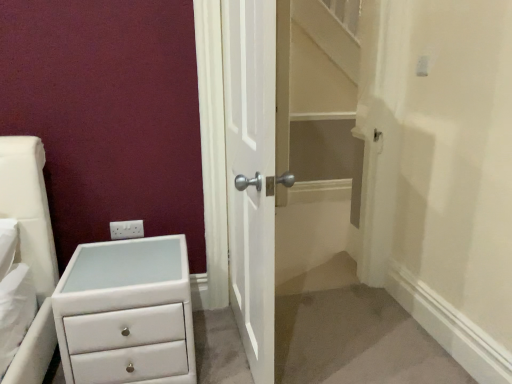
Question: Is white wooden door at center bigger or smaller than white glossy chest of drawers at lower left?

Choices:
 (A) big
 (B) small

Answer: (A)

Question: In the image, is white wooden door at center positioned in front of or behind white glossy chest of drawers at lower left?

Choices:
 (A) behind
 (B) front

Answer: (B)

Question: Which object is the closest to the white plastic electric outlet at upper left?

Choices:
 (A) white glossy chest of drawers at lower left
 (B) white wooden door at center

Answer: (A)

Question: Considering the real-world distances, which object is farthest from the white wooden door at center?

Choices:
 (A) white glossy chest of drawers at lower left
 (B) white plastic electric outlet at upper left

Answer: (B)